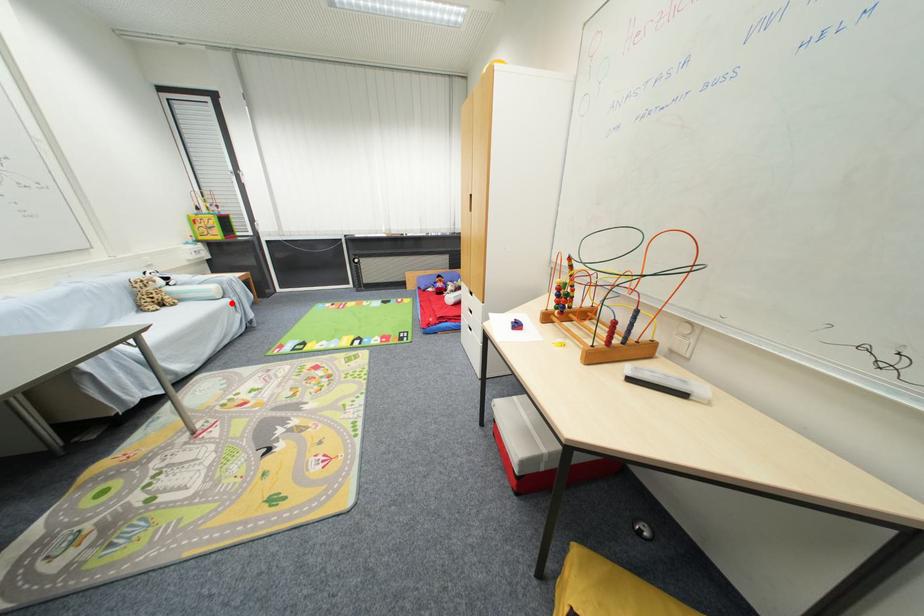
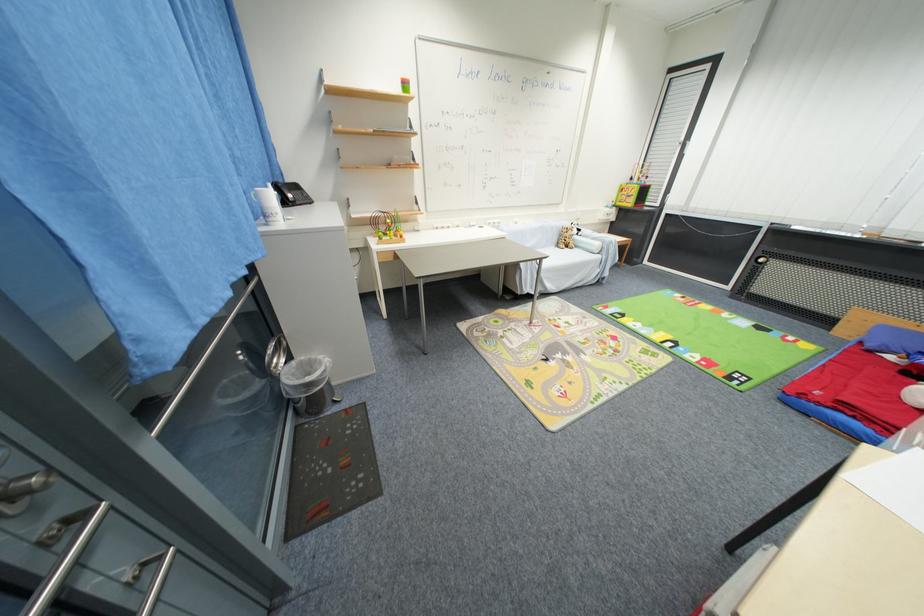
Question: A red point is marked in image1. In image2, is the corresponding 3D point closer to the camera or farther? Reply with the corresponding letter.

Choices:
 (A) The corresponding 3D point is closer.
 (B) The corresponding 3D point is farther.

Answer: (B)